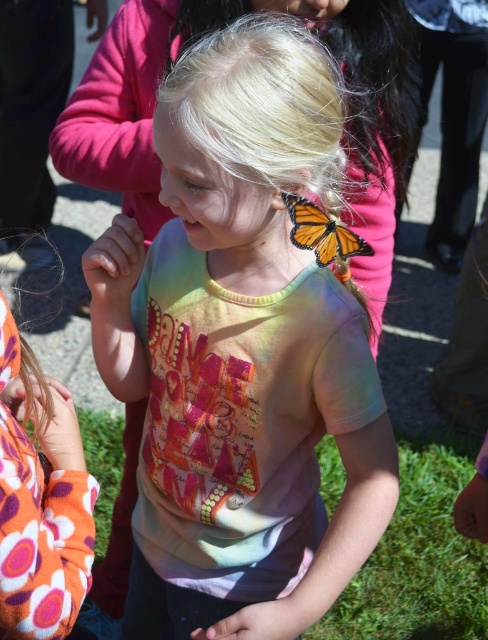
Based on the photo, does pastel tie-dye t-shirt at center appear under translucent orange butterfly at upper center?

Yes, pastel tie-dye t-shirt at center is below translucent orange butterfly at upper center.

Is point (306, 275) in front of point (297, 195)?

No, it is not.

At what (x,y) coordinates should I click in order to perform the action: click on pastel tie-dye t-shirt at center. Please return your answer as a coordinate pair (x, y). Looking at the image, I should click on (241, 349).